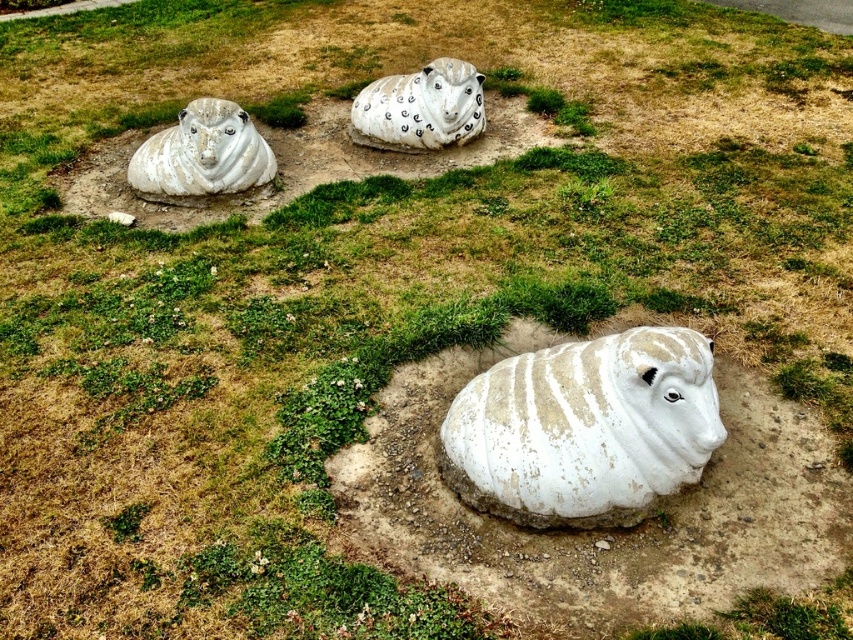
Question: Is white matte sheep at upper left thinner than white matte sheep at center?

Choices:
 (A) yes
 (B) no

Answer: (A)

Question: Which point is closer to the camera taking this photo?

Choices:
 (A) (479, 390)
 (B) (473, 122)
 (C) (157, 145)

Answer: (A)

Question: Considering the real-world distances, which object is farthest from the white matte sheep at center?

Choices:
 (A) white textured sheep at center
 (B) white matte sheep at upper left

Answer: (A)

Question: Is white matte sheep at upper left bigger than white matte sheep at center?

Choices:
 (A) no
 (B) yes

Answer: (A)

Question: Is white textured sheep at center to the right of white matte sheep at upper left from the viewer's perspective?

Choices:
 (A) yes
 (B) no

Answer: (A)

Question: Which point is farther to the camera?

Choices:
 (A) white textured sheep at center
 (B) white matte sheep at upper left
 (C) white matte sheep at center

Answer: (C)